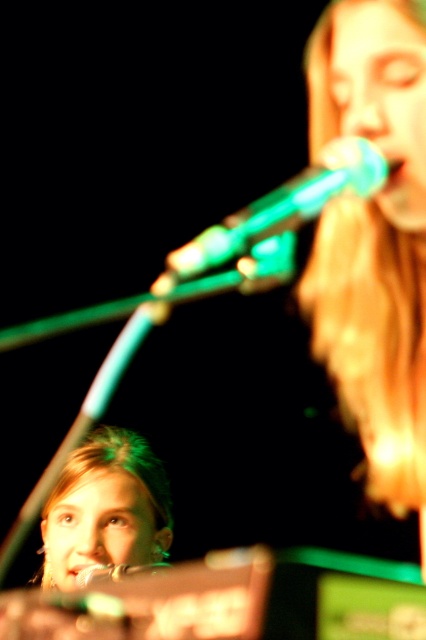
Question: Does shiny gold microphone at upper right appear on the right side of green metallic microphone at center?

Choices:
 (A) no
 (B) yes

Answer: (B)

Question: Which object appears closest to the camera in this image?

Choices:
 (A) blonde hair at lower left
 (B) matte skin at center
 (C) green metallic microphone at center

Answer: (C)

Question: Is shiny gold microphone at upper right behind blonde hair at lower left?

Choices:
 (A) yes
 (B) no

Answer: (B)

Question: Based on their relative distances, which object is farther from the green metallic microphone at center?

Choices:
 (A) blonde hair at lower left
 (B) matte skin at center

Answer: (A)

Question: Is shiny gold microphone at upper right bigger than blonde hair at lower left?

Choices:
 (A) yes
 (B) no

Answer: (B)

Question: Which of the following is the closest to the observer?

Choices:
 (A) (77, 566)
 (B) (285, 257)
 (C) (333, 227)

Answer: (B)